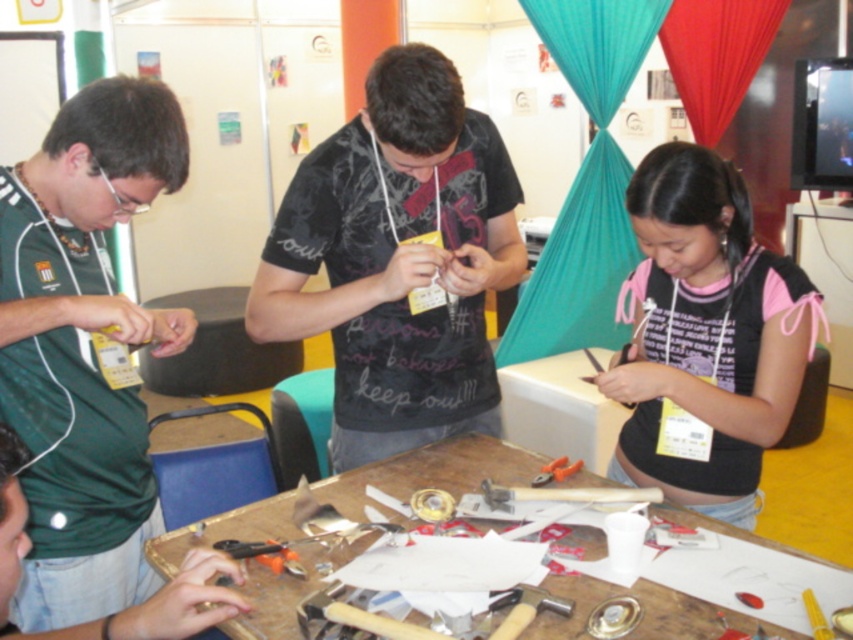
You are organizing a workshop and need to ensure there is enough space for all participants. Looking at the image, which object takes up more area in the scene between the green matte shirt at left and the wooden workbench at center?

The wooden workbench at center occupies more space than the green matte shirt at left.

You are at a workshop and need to locate the green matte shirt at left and the wooden workbench at center. From the perspective of someone facing the scene, which object is on the left side?

The green matte shirt at left is positioned on the left side of the wooden workbench at center, so the green matte shirt at left is on the left side.